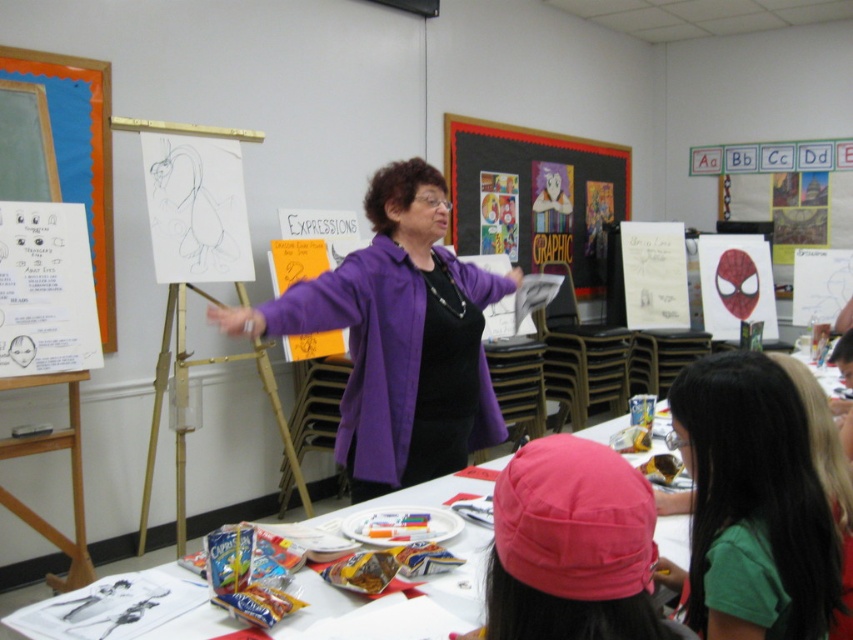
Which of these two, green matte hair at lower right or orange felt bulletin board at upper left, stands taller?

orange felt bulletin board at upper left is taller.

Who is positioned more to the left, green matte hair at lower right or orange felt bulletin board at upper left?

orange felt bulletin board at upper left

What do you see at coordinates (753, 502) in the screenshot?
I see `green matte hair at lower right` at bounding box center [753, 502].

The width and height of the screenshot is (853, 640). Identify the location of green matte hair at lower right. (753, 502).

Can you confirm if purple matte jacket at center is positioned above matte black bulletin board at center?

No.

Is purple matte jacket at center shorter than matte black bulletin board at center?

Correct, purple matte jacket at center is not as tall as matte black bulletin board at center.

Does point (418, 289) come closer to viewer compared to point (491, 230)?

That is True.

Where is `purple matte jacket at center`? purple matte jacket at center is located at coordinates (399, 337).

Is white paper at center taller than pink fabric cap at center?

Yes.

Does white paper at center appear on the left side of pink fabric cap at center?

Correct, you'll find white paper at center to the left of pink fabric cap at center.

Which is in front, point (524, 564) or point (596, 628)?

Point (596, 628) is in front.

The height and width of the screenshot is (640, 853). In order to click on white paper at center in this screenshot , I will do `click(573, 525)`.